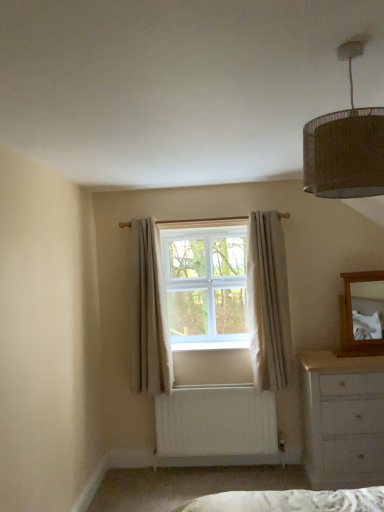
Question: From a real-world perspective, is white painted wood chest of drawers at lower right under white textured curtain at center, the first curtain viewed from the right?

Choices:
 (A) yes
 (B) no

Answer: (A)

Question: Are white painted wood chest of drawers at lower right and white textured curtain at center, which is counted as the 2th curtain, starting from the left, beside each other?

Choices:
 (A) no
 (B) yes

Answer: (A)

Question: Considering the relative sizes of white painted wood chest of drawers at lower right and white textured curtain at center, the first curtain viewed from the right, in the image provided, is white painted wood chest of drawers at lower right wider than white textured curtain at center, the first curtain viewed from the right,?

Choices:
 (A) no
 (B) yes

Answer: (B)

Question: Does white painted wood chest of drawers at lower right have a smaller size compared to white textured curtain at center, the first curtain viewed from the right?

Choices:
 (A) yes
 (B) no

Answer: (B)

Question: Is white painted wood chest of drawers at lower right positioned in front of white textured curtain at center, the first curtain viewed from the right?

Choices:
 (A) no
 (B) yes

Answer: (B)

Question: Is white textured curtain at center, the first curtain viewed from the right, at the back of white painted wood chest of drawers at lower right?

Choices:
 (A) yes
 (B) no

Answer: (B)

Question: Considering the relative sizes of braided wicker lampshade at upper right and wooden mirror at right in the image provided, is braided wicker lampshade at upper right shorter than wooden mirror at right?

Choices:
 (A) no
 (B) yes

Answer: (B)

Question: Is braided wicker lampshade at upper right wider than wooden mirror at right?

Choices:
 (A) yes
 (B) no

Answer: (A)

Question: Is wooden mirror at right inside braided wicker lampshade at upper right?

Choices:
 (A) yes
 (B) no

Answer: (B)

Question: Is the depth of braided wicker lampshade at upper right greater than that of wooden mirror at right?

Choices:
 (A) yes
 (B) no

Answer: (B)

Question: Is braided wicker lampshade at upper right not within wooden mirror at right?

Choices:
 (A) no
 (B) yes

Answer: (B)

Question: Is wooden mirror at right at the back of braided wicker lampshade at upper right?

Choices:
 (A) no
 (B) yes

Answer: (A)

Question: From a real-world perspective, is wooden mirror at right positioned over white plastic window at center based on gravity?

Choices:
 (A) yes
 (B) no

Answer: (B)